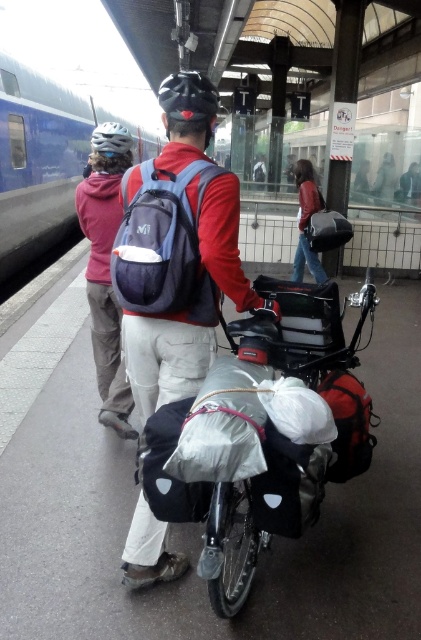
You are standing at the train station platform. There are two points marked on the ground. The first point is at coordinates point (x=20, y=65) and the second point is at point (x=103, y=157). Which point is closer to the person in the red jacket and white pants?

Point (x=103, y=157) is closer to the person in the red jacket and white pants because point (x=20, y=65) is behind it.

You are a photographer standing at the train station platform. You want to take a closeup photo of the matte blue backpack at center. Considering your current position, can you estimate whether you need to move closer or farther away to get a clear, focused shot?

The matte blue backpack at center is 1.91 meters away from the camera. To take a closeup photo, you would need to move closer than 1.91 meters to get a clearer, focused shot.

You are standing at the train station platform and see the scene described. There is a point marked at coordinates (x=178, y=252). What object is located at that point?

The point at coordinates (x=178, y=252) indicates the matte blue backpack at center.